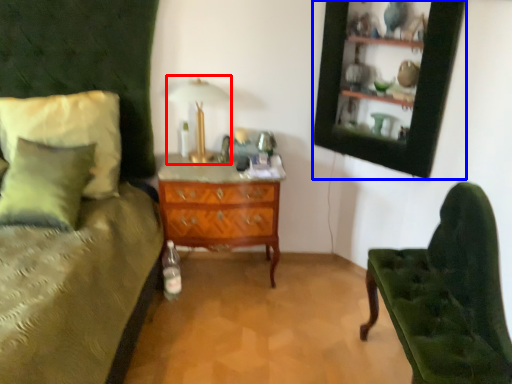
Question: Which object appears farthest to the camera in this image, table lamp (highlighted by a red box) or picture frame (highlighted by a blue box)?

Choices:
 (A) table lamp
 (B) picture frame

Answer: (A)